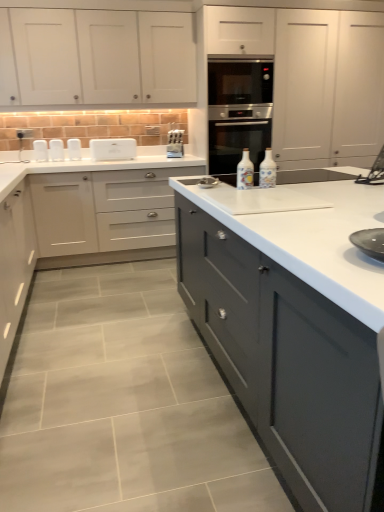
Question: From the image's perspective, relative to white matte cabinet at upper left, which is counted as the first cabinetry, starting from the top, is white plastic toaster at upper center, the 3th appliance in the left-to-right sequence, above or below?

Choices:
 (A) below
 (B) above

Answer: (A)

Question: In the image, is white plastic toaster at upper center, the 3th appliance in the left-to-right sequence, positioned in front of or behind white matte cabinet at upper left, which is counted as the first cabinetry, starting from the top?

Choices:
 (A) behind
 (B) front

Answer: (A)

Question: Which object is positioned farthest from the black glass oven at center?

Choices:
 (A) white plastic toaster at upper center, the 3th appliance in the left-to-right sequence
 (B) white ceramic bottle at center, which appears as the second bottle when viewed from the right
 (C) satin silver knife block at center, the first appliance from the right
 (D) matte white cabinets at center, the 4th cabinetry in the top-to-bottom sequence
 (E) white plastic toaster at upper left, which is counted as the 4th appliance, starting from the right

Answer: (D)

Question: Estimate the real-world distances between objects in this image. Which object is closer to the white plastic toaster at upper center, marked as the second appliance in a right-to-left arrangement?

Choices:
 (A) white ceramic bottle at center, which appears as the second bottle when viewed from the right
 (B) white matte cabinet at center, acting as the 3th cabinetry starting from the top
 (C) white plastic toaster at left, acting as the 3th appliance starting from the right
 (D) white plastic toaster at upper left, which is counted as the 4th appliance, starting from the right
 (E) black glass oven at center

Answer: (C)